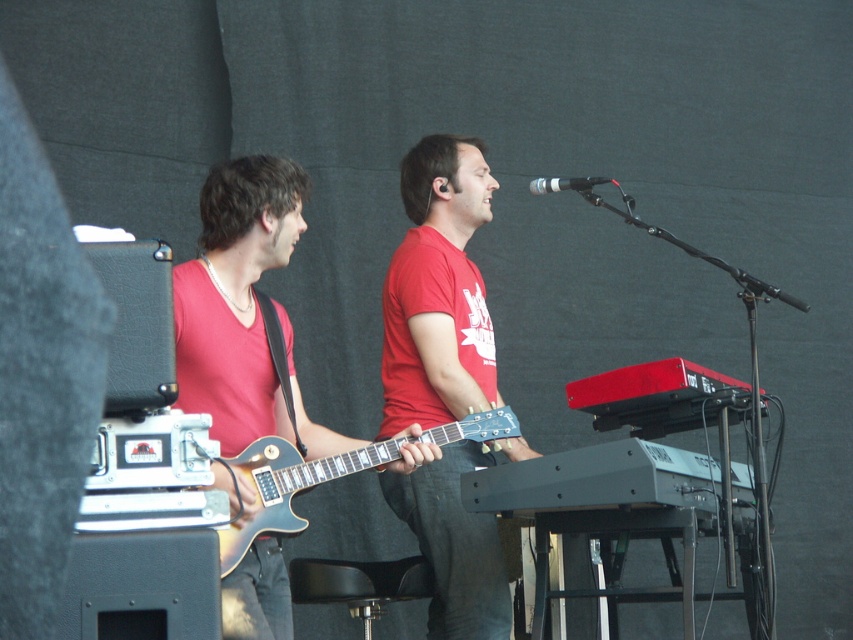
Between shiny black guitar at left and black metallic microphone at upper center, which one has more height?

Standing taller between the two is shiny black guitar at left.

Looking at this image, does shiny black guitar at left have a larger size compared to black metallic microphone at upper center?

Yes, shiny black guitar at left is bigger than black metallic microphone at upper center.

Measure the distance between shiny black guitar at left and camera.

shiny black guitar at left and camera are 10.74 feet apart from each other.

The width and height of the screenshot is (853, 640). I want to click on shiny black guitar at left, so coord(242,308).

Which is above, matte red t-shirt at center or shiny black guitar at left?

Positioned higher is matte red t-shirt at center.

Does matte red t-shirt at center appear over shiny black guitar at left?

Yes.

Locate an element on the screen. Image resolution: width=853 pixels, height=640 pixels. matte red t-shirt at center is located at coordinates (438, 291).

Can you confirm if glossy wood guitar at center is thinner than black metallic microphone at upper center?

Incorrect, glossy wood guitar at center's width is not less than black metallic microphone at upper center's.

Can you confirm if glossy wood guitar at center is positioned above black metallic microphone at upper center?

Actually, glossy wood guitar at center is below black metallic microphone at upper center.

Locate an element on the screen. The height and width of the screenshot is (640, 853). glossy wood guitar at center is located at coordinates (288, 486).

Locate an element on the screen. This screenshot has height=640, width=853. glossy wood guitar at center is located at coordinates 288,486.